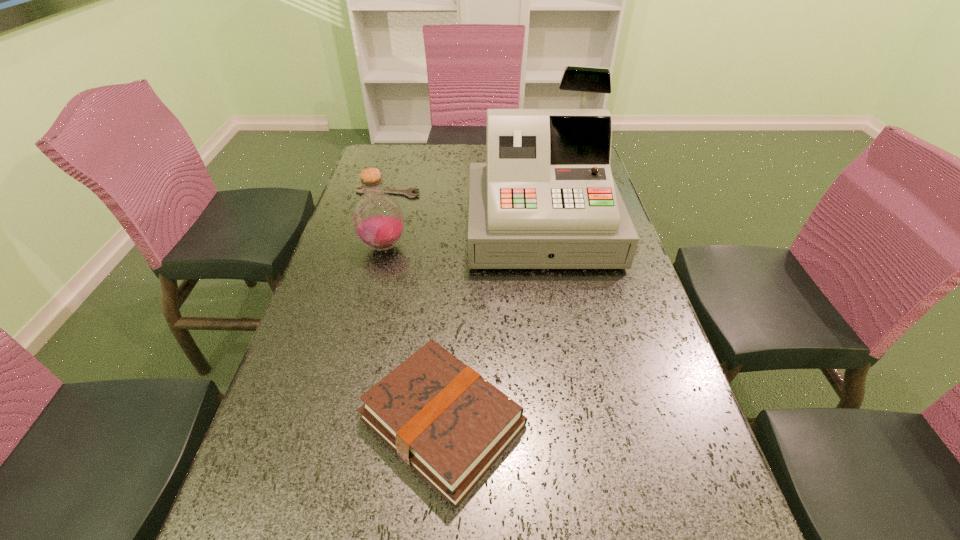
Locate an element on the screen. The width and height of the screenshot is (960, 540). the tallest object is located at coordinates (545, 199).

Locate an element on the screen. Image resolution: width=960 pixels, height=540 pixels. bottle is located at coordinates (378, 220).

Where is `the nearest object`? This screenshot has width=960, height=540. the nearest object is located at coordinates (447, 422).

Locate an element on the screen. This screenshot has width=960, height=540. hardback book is located at coordinates (447, 422).

Where is `the shortest object`? The width and height of the screenshot is (960, 540). the shortest object is located at coordinates (407, 192).

Where is `free location located on the keypad side of the tallest object`? free location located on the keypad side of the tallest object is located at coordinates point(573,413).

This screenshot has height=540, width=960. Find the location of `free space located on the right of the bottle`. free space located on the right of the bottle is located at coordinates (444, 246).

Find the location of a particular element. Image resolution: width=960 pixels, height=540 pixels. free space located 0.060m on the back of the third tallest object is located at coordinates (449, 333).

The width and height of the screenshot is (960, 540). Find the location of `free space located on the front of the wrench`. free space located on the front of the wrench is located at coordinates tap(381, 217).

You are a GUI agent. You are given a task and a screenshot of the screen. Output one action in this format:
    pyautogui.click(x=<x>, y=<y>)
    Task: Click on the bottle that is at the left edge
    
    Given the screenshot: What is the action you would take?
    pyautogui.click(x=378, y=220)